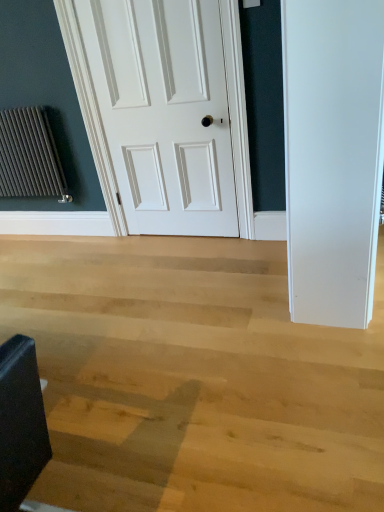
The width and height of the screenshot is (384, 512). What do you see at coordinates (164, 112) in the screenshot?
I see `white matte door at center` at bounding box center [164, 112].

The width and height of the screenshot is (384, 512). In order to click on white matte door at center in this screenshot , I will do click(x=164, y=112).

Locate an element on the screen. dark gray textured radiator at left is located at coordinates (30, 156).

Describe the element at coordinates (30, 156) in the screenshot. I see `dark gray textured radiator at left` at that location.

Find the location of `white matte door at center`. white matte door at center is located at coordinates (164, 112).

Between white matte door at center and dark gray textured radiator at left, which one appears on the left side from the viewer's perspective?

From the viewer's perspective, dark gray textured radiator at left appears more on the left side.

Is white matte door at center behind dark gray textured radiator at left?

No, it is not.

Is point (182, 133) closer or farther from the camera than point (11, 164)?

Point (182, 133).

From the image's perspective, does white matte door at center appear lower than dark gray textured radiator at left?

Actually, white matte door at center appears above dark gray textured radiator at left in the image.

From a real-world perspective, which is physically below, white matte door at center or dark gray textured radiator at left?

In real-world perspective, dark gray textured radiator at left is lower.

Which of these two, white matte door at center or dark gray textured radiator at left, is thinner?

With smaller width is white matte door at center.

Consider the image. Who is shorter, white matte door at center or dark gray textured radiator at left?

Standing shorter between the two is dark gray textured radiator at left.

Considering the relative sizes of white matte door at center and dark gray textured radiator at left in the image provided, is white matte door at center smaller than dark gray textured radiator at left?

Incorrect, white matte door at center is not smaller in size than dark gray textured radiator at left.

Consider the image. Does white matte door at center contain dark gray textured radiator at left?

That's incorrect, dark gray textured radiator at left is not inside white matte door at center.

Would you consider white matte door at center to be distant from dark gray textured radiator at left?

No, white matte door at center is not far from dark gray textured radiator at left.

Is white matte door at center facing away from dark gray textured radiator at left?

white matte door at center is not turned away from dark gray textured radiator at left.

In the image, there is a dark gray textured radiator at left. In order to click on door above it (from the image's perspective) in this screenshot , I will do tap(164, 112).

Considering the positions of objects dark gray textured radiator at left and white matte door at center in the image provided, who is more to the right, dark gray textured radiator at left or white matte door at center?

Positioned to the right is white matte door at center.

Which object is closer to the camera, dark gray textured radiator at left or white matte door at center?

white matte door at center is in front.

Is point (50, 130) farther from camera compared to point (210, 82)?

Yes.

From the image's perspective, is dark gray textured radiator at left on white matte door at center?

No, from the image's perspective, dark gray textured radiator at left is not on top of white matte door at center.

From a real-world perspective, is dark gray textured radiator at left located higher than white matte door at center?

No, from a real-world perspective, dark gray textured radiator at left is not on top of white matte door at center.

Is dark gray textured radiator at left wider than white matte door at center?

Indeed, dark gray textured radiator at left has a greater width compared to white matte door at center.

From their relative heights in the image, would you say dark gray textured radiator at left is taller or shorter than white matte door at center?

dark gray textured radiator at left is shorter than white matte door at center.

Based on their sizes in the image, would you say dark gray textured radiator at left is bigger or smaller than white matte door at center?

Considering their sizes, dark gray textured radiator at left takes up less space than white matte door at center.

Is white matte door at center located within dark gray textured radiator at left?

Actually, white matte door at center is outside dark gray textured radiator at left.

Is the surface of dark gray textured radiator at left in direct contact with white matte door at center?

They are not placed beside each other.

Does dark gray textured radiator at left turn towards white matte door at center?

No, dark gray textured radiator at left is not turned towards white matte door at center.

Identify the location of radiator below the white matte door at center (from the image's perspective). The image size is (384, 512). (30, 156).

Where is `door in front of the dark gray textured radiator at left`? door in front of the dark gray textured radiator at left is located at coordinates (164, 112).

The width and height of the screenshot is (384, 512). I want to click on radiator beneath the white matte door at center (from a real-world perspective), so click(30, 156).